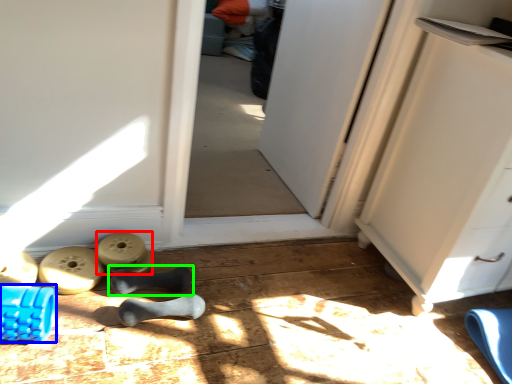
Question: Estimate the real-world distances between objects in this image. Which object is closer to job (highlighted by a red box), job (highlighted by a blue box) or footwear (highlighted by a green box)?

Choices:
 (A) job
 (B) footwear

Answer: (B)